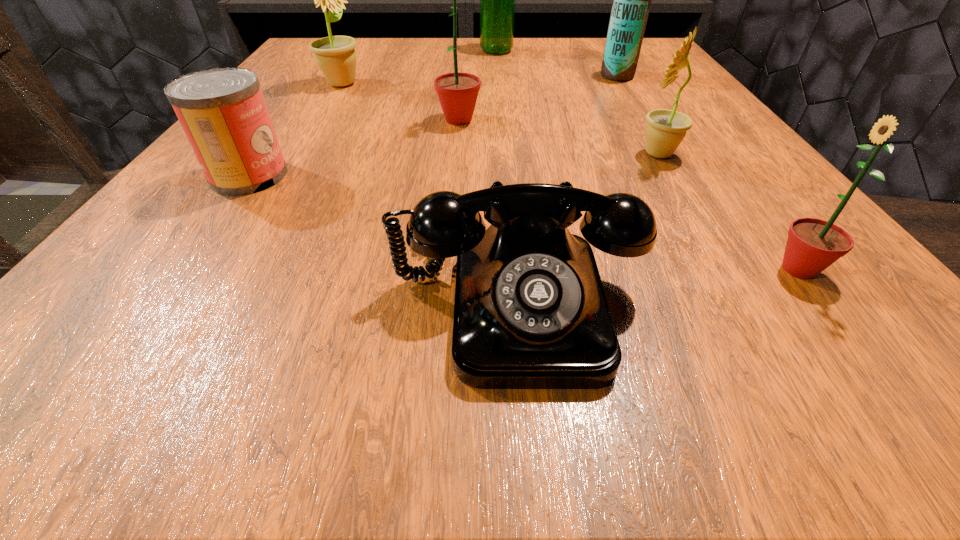
At what (x,y) coordinates should I click in order to perform the action: click on the left beer bottle. Please return your answer as a coordinate pair (x, y). Image resolution: width=960 pixels, height=540 pixels. Looking at the image, I should click on (497, 0).

Locate an element on the screen. the farthest object is located at coordinates (497, 0).

You are a GUI agent. You are given a task and a screenshot of the screen. Output one action in this format:
    pyautogui.click(x=<x>, y=<y>)
    Task: Click on the right beer bottle
    Image resolution: width=960 pixels, height=540 pixels.
    Given the screenshot: What is the action you would take?
    pyautogui.click(x=632, y=0)

The height and width of the screenshot is (540, 960). What are the coordinates of `the left yellow sunflower` in the screenshot? It's located at (335, 55).

Identify the location of the leftmost sunflower. The image size is (960, 540). (335, 55).

You are a GUI agent. You are given a task and a screenshot of the screen. Output one action in this format:
    pyautogui.click(x=<x>, y=<y>)
    Task: Click on the fourth farthest object
    
    Given the screenshot: What is the action you would take?
    pyautogui.click(x=457, y=92)

The image size is (960, 540). Find the location of `the left green sunflower`. the left green sunflower is located at coordinates (457, 92).

You are a GUI agent. You are given a task and a screenshot of the screen. Output one action in this format:
    pyautogui.click(x=<x>, y=<y>)
    Task: Click on the third sunflower from left to right
    The image size is (960, 540).
    Given the screenshot: What is the action you would take?
    pos(665,130)

The image size is (960, 540). What are the coordinates of `the smaller yellow sunflower` in the screenshot? It's located at (665, 130).

Find the location of a particular element. The width and height of the screenshot is (960, 540). the nearer green sunflower is located at coordinates (813, 244).